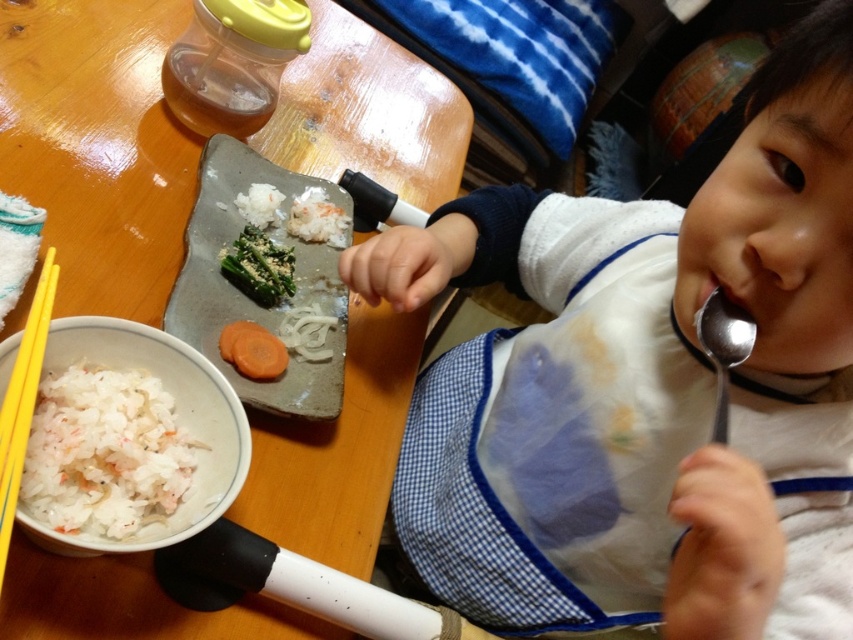
Question: Is the position of yellow plastic chopsticks at lower left more distant than that of satin silver spoon at mouth?

Choices:
 (A) no
 (B) yes

Answer: (A)

Question: Estimate the real-world distances between objects in this image. Which object is farther from the yellow plastic chopsticks at lower left?

Choices:
 (A) green matte broccoli at center
 (B) gray stone tray at center

Answer: (A)

Question: Which point is farther from the camera taking this photo?

Choices:
 (A) (241, 301)
 (B) (339, 323)
 (C) (489, 458)

Answer: (C)

Question: Can you confirm if white fabric bib at center is positioned to the right of wooden table at center?

Choices:
 (A) yes
 (B) no

Answer: (A)

Question: Is white fabric bib at center bigger than sliced orange carrot at center?

Choices:
 (A) no
 (B) yes

Answer: (B)

Question: Which object is positioned farthest from the white rice at lower left?

Choices:
 (A) green matte broccoli at center
 (B) sliced orange carrot at center
 (C) white fabric bib at center
 (D) wooden table at center

Answer: (C)